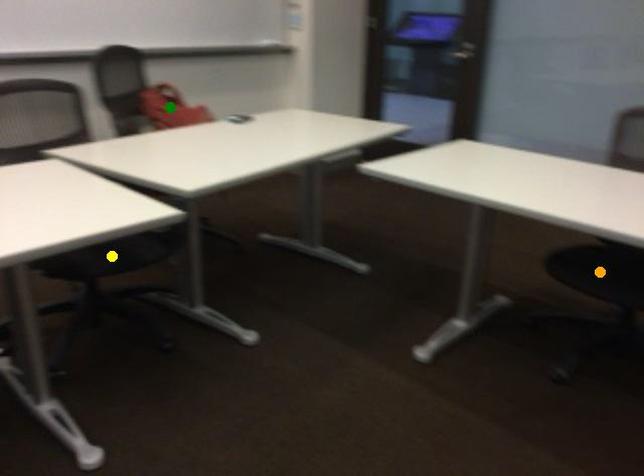
Order these from nearest to farthest:
green point
yellow point
orange point

1. yellow point
2. orange point
3. green point